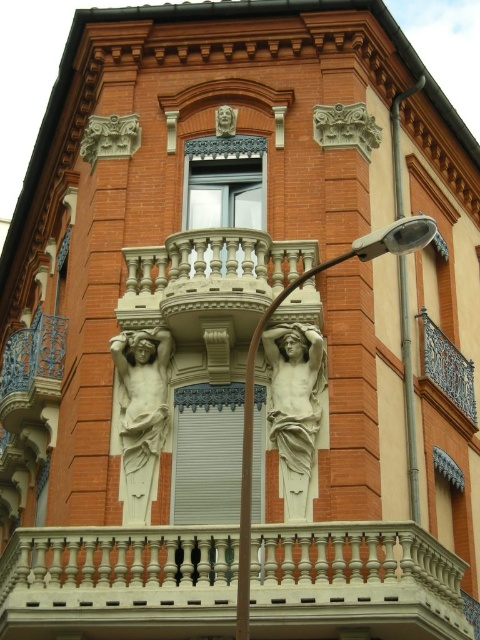
Between white marble statue at center and matte stone face at upper center, which one is positioned higher?

matte stone face at upper center

Between white marble statue at center and matte stone face at upper center, which one has less height?

matte stone face at upper center

Which is behind, point (278, 394) or point (216, 125)?

Point (216, 125)

The width and height of the screenshot is (480, 640). Identify the location of white marble statue at center. (295, 406).

Can you confirm if white marble statue at center is positioned above metallic gray streetlight at center?

Incorrect, white marble statue at center is not positioned above metallic gray streetlight at center.

Is white marble statue at center in front of metallic gray streetlight at center?

No, white marble statue at center is behind metallic gray streetlight at center.

Measure the distance between point (313, 401) and camera.

Point (313, 401) and camera are 46.50 meters apart from each other.

Image resolution: width=480 pixels, height=640 pixels. Find the location of `white marble statue at center`. white marble statue at center is located at coordinates (295, 406).

From the picture: Does white marble balustrade at center have a larger size compared to matte stone face at upper center?

Correct, white marble balustrade at center is larger in size than matte stone face at upper center.

Measure the distance from white marble balustrade at center to matte stone face at upper center.

white marble balustrade at center is 24.02 meters away from matte stone face at upper center.

What are the coordinates of `white marble balustrade at center` in the screenshot? It's located at (119, 582).